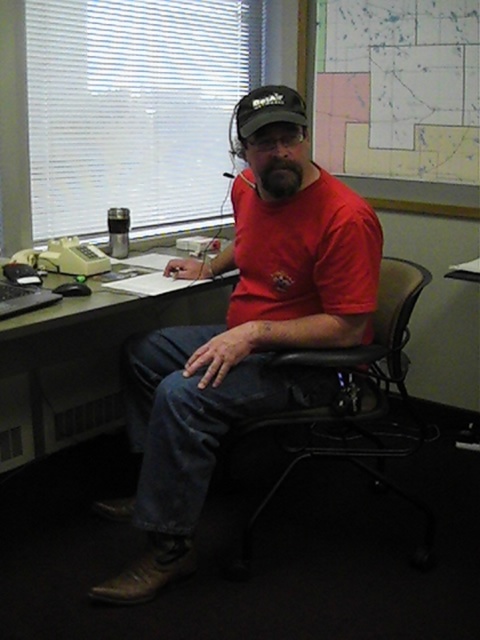
Question: Based on their relative distances, which object is nearer to the map paper at upper right?

Choices:
 (A) black plastic chair at center
 (B) red matte shirt at center

Answer: (A)

Question: Is red matte shirt at center closer to the viewer compared to map paper at upper right?

Choices:
 (A) yes
 (B) no

Answer: (A)

Question: Is black plastic chair at center to the right of map paper at upper right from the viewer's perspective?

Choices:
 (A) no
 (B) yes

Answer: (A)

Question: Observing the image, what is the correct spatial positioning of red matte shirt at center in reference to matte black desk at center?

Choices:
 (A) left
 (B) right

Answer: (B)

Question: Which of the following is the closest to the observer?

Choices:
 (A) (440, 212)
 (B) (425, 564)
 (C) (12, 444)
 (D) (307, 243)

Answer: (D)

Question: Which point appears farthest from the camera in this image?

Choices:
 (A) (215, 337)
 (B) (120, 337)
 (C) (437, 209)
 (D) (393, 348)

Answer: (C)